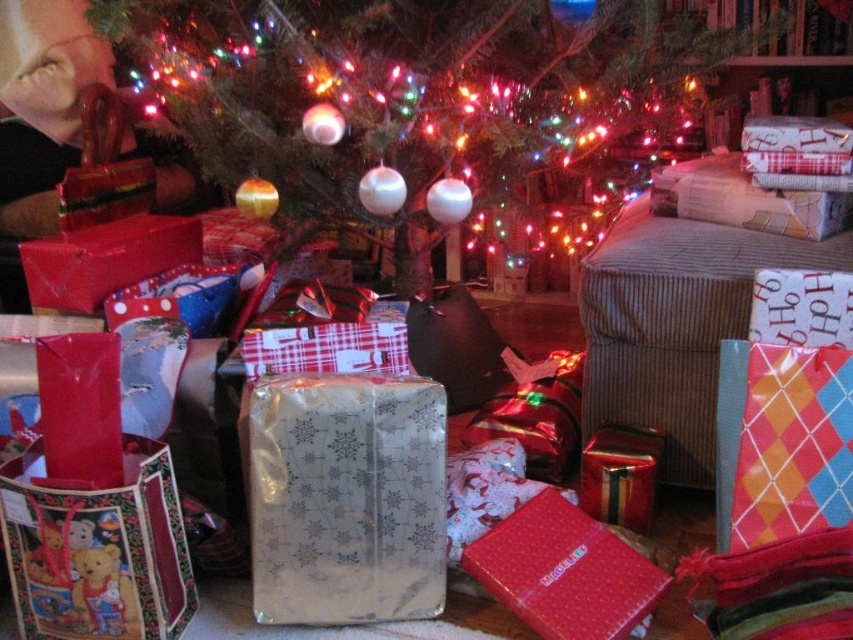
What do you see at coordinates (346, 499) in the screenshot? Image resolution: width=853 pixels, height=640 pixels. I see `silver metallic gift wrap at center` at bounding box center [346, 499].

Is silver metallic gift wrap at center shorter than shiny metallic gift at center?

Incorrect, silver metallic gift wrap at center's height does not fall short of shiny metallic gift at center's.

Which is behind, point (383, 572) or point (630, 506)?

The point (630, 506) is more distant.

This screenshot has height=640, width=853. Find the location of `silver metallic gift wrap at center`. silver metallic gift wrap at center is located at coordinates coord(346,499).

Can you confirm if matte red gift at center is positioned above shiny metallic gift at center?

Incorrect, matte red gift at center is not positioned above shiny metallic gift at center.

Can you confirm if matte red gift at center is thinner than shiny metallic gift at center?

In fact, matte red gift at center might be wider than shiny metallic gift at center.

The height and width of the screenshot is (640, 853). I want to click on matte red gift at center, so click(566, 572).

Does shiny green tree at center have a greater width compared to silver metallic gift wrap at center?

Indeed, shiny green tree at center has a greater width compared to silver metallic gift wrap at center.

Describe the element at coordinates (409, 86) in the screenshot. I see `shiny green tree at center` at that location.

You are a GUI agent. You are given a task and a screenshot of the screen. Output one action in this format:
    pyautogui.click(x=<x>, y=<y>)
    Task: Click on the shiny green tree at center
    The width and height of the screenshot is (853, 640).
    Given the screenshot: What is the action you would take?
    pyautogui.click(x=409, y=86)